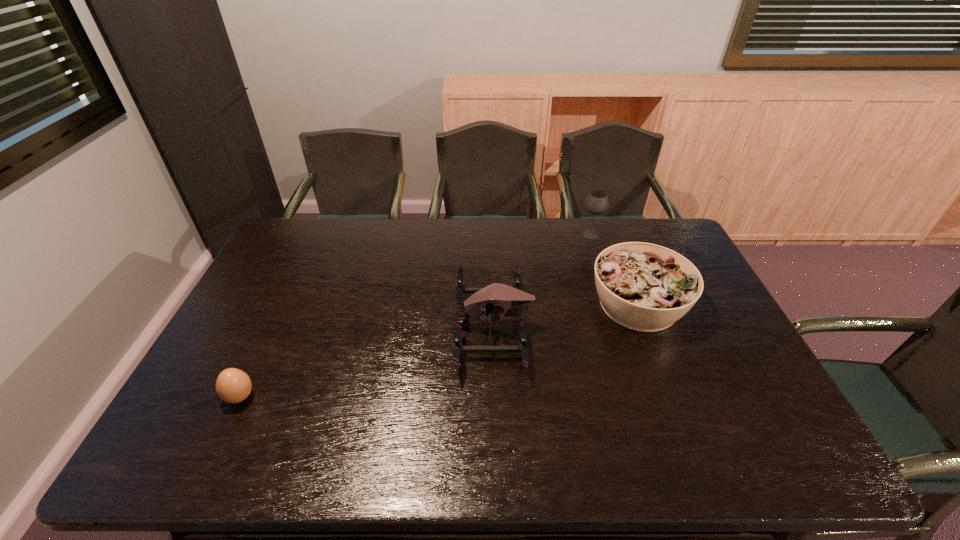
Where is `free space located 0.330m on the front-facing side of the drone`? free space located 0.330m on the front-facing side of the drone is located at coordinates pos(341,326).

At what (x,y) coordinates should I click in order to perform the action: click on vacant space located 0.400m on the back of the shortest object. Please return your answer as a coordinate pair (x, y). The width and height of the screenshot is (960, 540). Looking at the image, I should click on (296, 281).

Where is `object located at the far edge`? This screenshot has width=960, height=540. object located at the far edge is located at coordinates (596, 202).

At what (x,y) coordinates should I click in order to perform the action: click on object that is at the left edge. Please return your answer as a coordinate pair (x, y). The height and width of the screenshot is (540, 960). Looking at the image, I should click on 233,385.

At what (x,y) coordinates should I click in order to perform the action: click on object located at the right edge. Please return your answer as a coordinate pair (x, y). This screenshot has height=540, width=960. Looking at the image, I should click on click(x=644, y=287).

In the image, there is a desktop. At what (x,y) coordinates should I click in order to perform the action: click on blank space at the far edge. Please return your answer as a coordinate pair (x, y). Image resolution: width=960 pixels, height=540 pixels. Looking at the image, I should click on (417, 249).

Locate an element on the screen. Image resolution: width=960 pixels, height=540 pixels. vacant space at the near edge is located at coordinates (641, 464).

The width and height of the screenshot is (960, 540). I want to click on free space at the left edge, so click(x=247, y=352).

The image size is (960, 540). Find the location of `vacant space at the far left corner`. vacant space at the far left corner is located at coordinates pyautogui.click(x=324, y=228).

Locate an element on the screen. This screenshot has height=540, width=960. vacant region at the far right corner of the desktop is located at coordinates (651, 227).